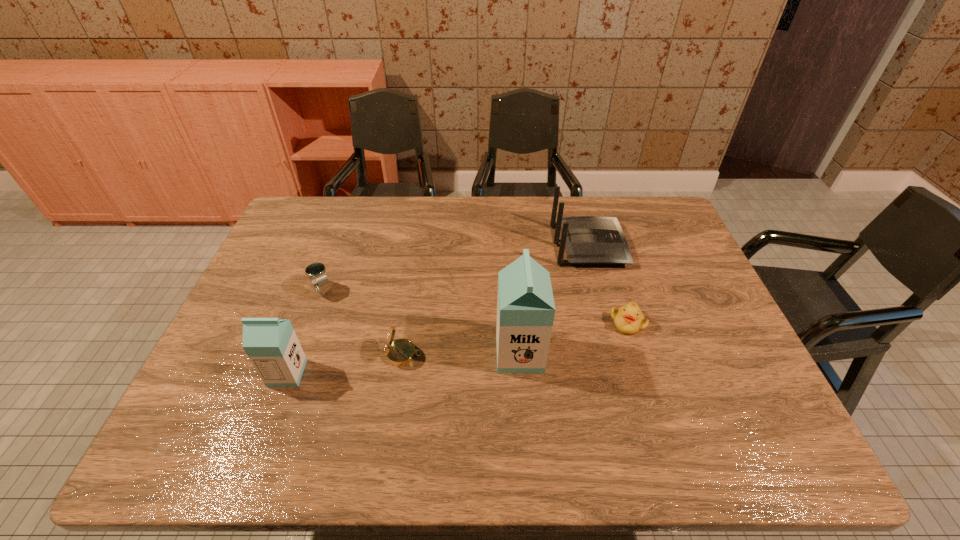
This screenshot has width=960, height=540. I want to click on vacant region located 0.130m on the back of the taller milk carton, so pos(516,300).

Identify the location of vacant area situated on the front-facing side of the router. The image size is (960, 540). (648, 246).

Where is `vacant position located 0.300m with the dial facing the compass`? The image size is (960, 540). vacant position located 0.300m with the dial facing the compass is located at coordinates (540, 354).

You are a GUI agent. You are given a task and a screenshot of the screen. Output one action in this format:
    pyautogui.click(x=<x>, y=<y>)
    Task: Click on the free space located on the right of the fifth nearest object
    
    Given the screenshot: What is the action you would take?
    pyautogui.click(x=371, y=291)

Find the location of a particular element. The image size is (960, 540). free space located on the front-facing side of the duckling is located at coordinates (642, 372).

Find the location of a particular element. This screenshot has width=960, height=540. object that is at the far edge is located at coordinates (589, 240).

The height and width of the screenshot is (540, 960). I want to click on object that is positioned at the near edge, so click(272, 346).

The width and height of the screenshot is (960, 540). Find the location of `object positioned at the left edge`. object positioned at the left edge is located at coordinates (272, 346).

This screenshot has width=960, height=540. What are the coordinates of `object that is at the near left corner` in the screenshot? It's located at (272, 346).

The height and width of the screenshot is (540, 960). Find the location of `free region at the far edge`. free region at the far edge is located at coordinates (372, 226).